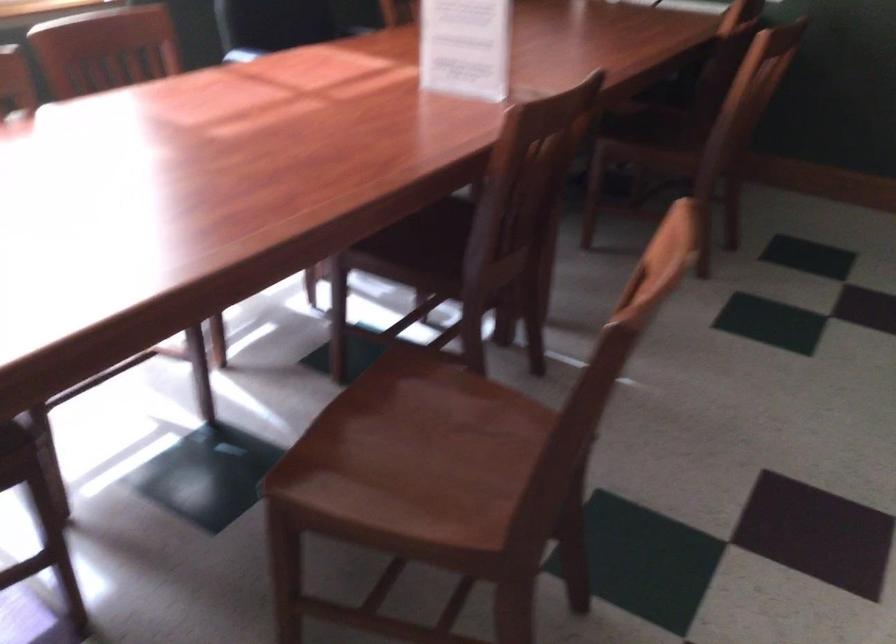
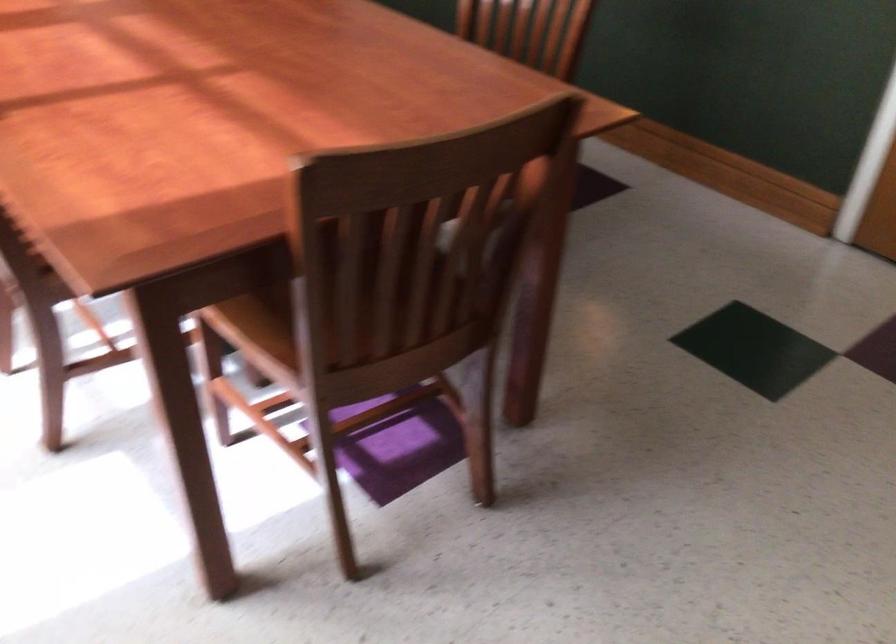
Question: I am providing you with two images of the same scene from different viewpoints. After the viewpoint changes to image2, which objects are now occluded?

Choices:
 (A) black numeric keypad
 (B) wooden chair sitting surface
 (C) chair sitting surface
 (D) purple square object

Answer: (C)